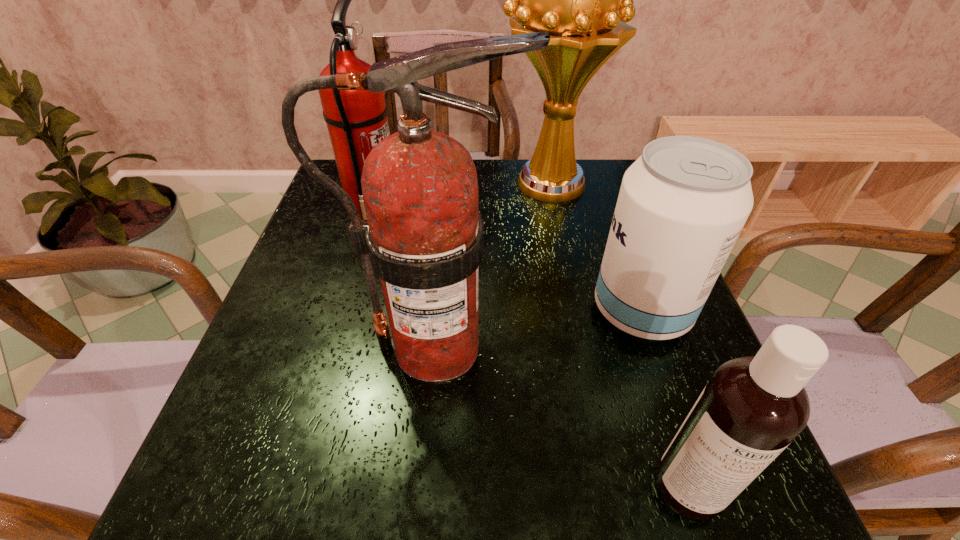
Where is `free point located 0.290m on the left of the alcohol`? free point located 0.290m on the left of the alcohol is located at coordinates (445, 310).

Find the location of a particular element. This screenshot has height=540, width=960. trophy_cup located in the far edge section of the desktop is located at coordinates (576, 0).

Locate an element on the screen. fire extinguisher that is at the far edge is located at coordinates (357, 121).

Where is `object present at the near edge`? This screenshot has height=540, width=960. object present at the near edge is located at coordinates (753, 407).

Where is `object present at the left edge`? object present at the left edge is located at coordinates (357, 121).

You are a GUI agent. You are given a task and a screenshot of the screen. Output one action in this format:
    pyautogui.click(x=<x>, y=<y>)
    Task: Click on the trophy_cup situated at the right edge
    The height and width of the screenshot is (540, 960).
    Given the screenshot: What is the action you would take?
    pyautogui.click(x=576, y=0)

Locate an element on the screen. alcohol that is at the right edge is located at coordinates (682, 204).

Locate an element on the screen. dishwasher detergent that is at the right edge is located at coordinates (753, 407).

Where is `object located at the far left corner`? The height and width of the screenshot is (540, 960). object located at the far left corner is located at coordinates (357, 121).

This screenshot has height=540, width=960. Identify the location of object that is at the far right corner. click(x=576, y=0).